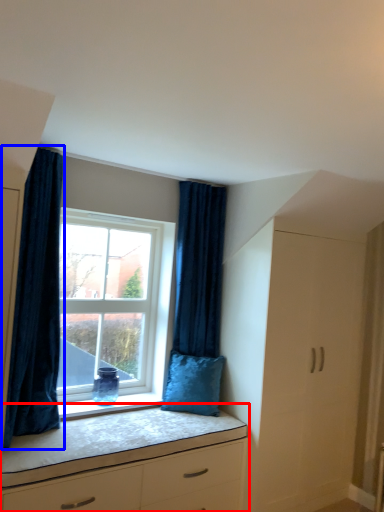
Question: Which of the following is the farthest to the observer, chest of drawers (highlighted by a red box) or curtain (highlighted by a blue box)?

Choices:
 (A) chest of drawers
 (B) curtain

Answer: (B)